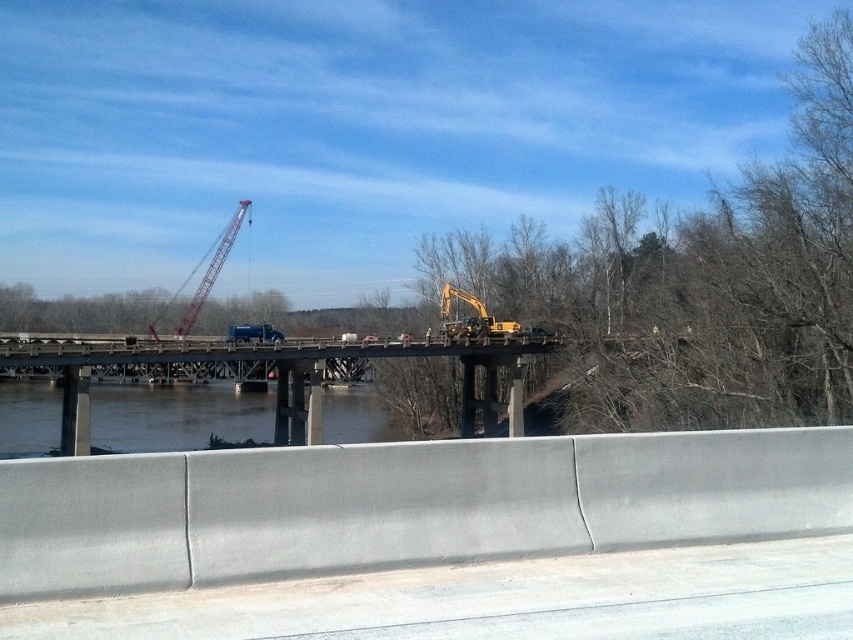
Is point (234, 358) farther from camera compared to point (186, 324)?

No, (234, 358) is closer to viewer.

Which of these two, concrete bridge at center or metallic red crane at center, stands taller?

metallic red crane at center

Between point (485, 394) and point (190, 317), which one is positioned in front?

Point (485, 394)

The width and height of the screenshot is (853, 640). What are the coordinates of `concrete bridge at center` in the screenshot? It's located at (273, 372).

Who is higher up, concrete bridge at center or clear water at lower center?

concrete bridge at center is higher up.

Is point (486, 364) in front of point (38, 449)?

No, it is behind (38, 449).

Who is more forward, (x=219, y=378) or (x=190, y=442)?

Point (x=190, y=442) is more forward.

The height and width of the screenshot is (640, 853). In order to click on concrete bridge at center in this screenshot , I will do `click(273, 372)`.

Who is more forward, (227, 408) or (235, 214)?

Positioned in front is point (227, 408).

Between clear water at lower center and metallic red crane at center, which one has more height?

metallic red crane at center is taller.

Which is behind, point (24, 445) or point (221, 250)?

Positioned behind is point (221, 250).

Find the location of a particular element. This screenshot has width=853, height=640. clear water at lower center is located at coordinates point(177,416).